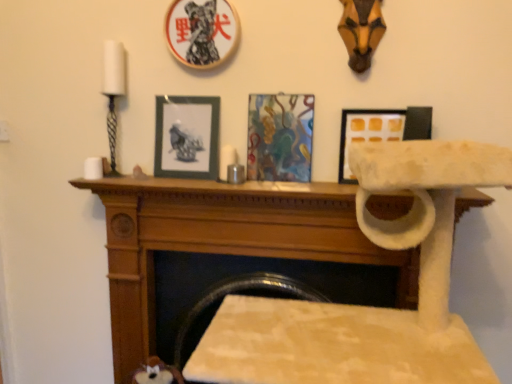
Question: Can you confirm if wooden mantle at center is smaller than blue-gray matte picture frame at center, which is counted as the first picture frame, starting from the left?

Choices:
 (A) no
 (B) yes

Answer: (A)

Question: Can you confirm if wooden mantle at center is taller than blue-gray matte picture frame at center, arranged as the fourth picture frame when viewed from the right?

Choices:
 (A) no
 (B) yes

Answer: (A)

Question: Does wooden mantle at center appear on the right side of blue-gray matte picture frame at center, arranged as the fourth picture frame when viewed from the right?

Choices:
 (A) no
 (B) yes

Answer: (B)

Question: Would you say wooden mantle at center is outside blue-gray matte picture frame at center, which is counted as the first picture frame, starting from the left?

Choices:
 (A) yes
 (B) no

Answer: (A)

Question: Is wooden mantle at center further to the viewer compared to blue-gray matte picture frame at center, which is counted as the first picture frame, starting from the left?

Choices:
 (A) yes
 (B) no

Answer: (B)

Question: From a real-world perspective, is wooden mantle at center located higher than blue-gray matte picture frame at center, which is counted as the first picture frame, starting from the left?

Choices:
 (A) yes
 (B) no

Answer: (B)

Question: Does abstract painting at center, the 3th picture frame from the left, lie behind wooden picture frame at upper center, the 2th picture frame from the left?

Choices:
 (A) no
 (B) yes

Answer: (B)

Question: From a real-world perspective, is abstract painting at center, the 3th picture frame from the left, on top of wooden picture frame at upper center, the 2th picture frame from the left?

Choices:
 (A) yes
 (B) no

Answer: (B)

Question: Does abstract painting at center, the second picture frame when ordered from right to left, have a lesser width compared to wooden picture frame at upper center, the 2th picture frame from the left?

Choices:
 (A) yes
 (B) no

Answer: (A)

Question: Is the depth of abstract painting at center, the second picture frame when ordered from right to left, less than that of wooden picture frame at upper center, the third picture frame viewed from the right?

Choices:
 (A) no
 (B) yes

Answer: (A)

Question: Considering the relative positions of abstract painting at center, the 3th picture frame from the left, and wooden picture frame at upper center, the 2th picture frame from the left, in the image provided, is abstract painting at center, the 3th picture frame from the left, to the right of wooden picture frame at upper center, the 2th picture frame from the left, from the viewer's perspective?

Choices:
 (A) yes
 (B) no

Answer: (A)

Question: From the image's perspective, is abstract painting at center, the second picture frame when ordered from right to left, on top of wooden picture frame at upper center, the 2th picture frame from the left?

Choices:
 (A) yes
 (B) no

Answer: (B)

Question: Is wooden mantle at center at the left side of wooden picture frame at upper center, the third picture frame viewed from the right?

Choices:
 (A) yes
 (B) no

Answer: (B)